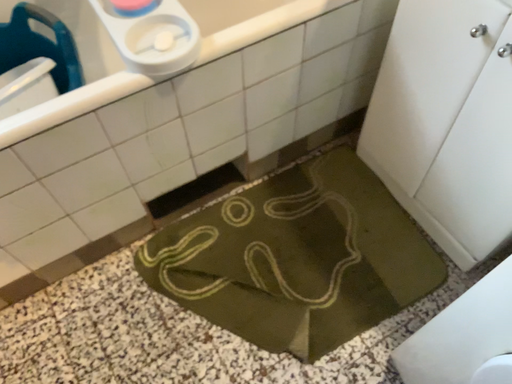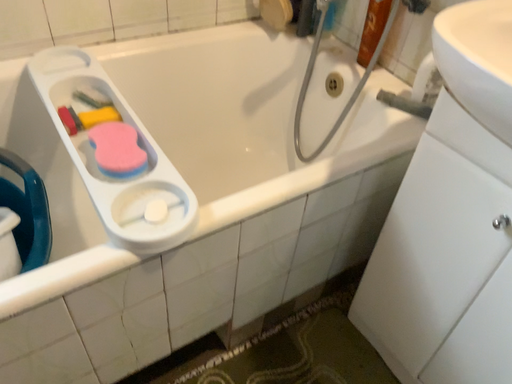
Question: Which way did the camera rotate in the video?

Choices:
 (A) rotated left
 (B) rotated right

Answer: (B)